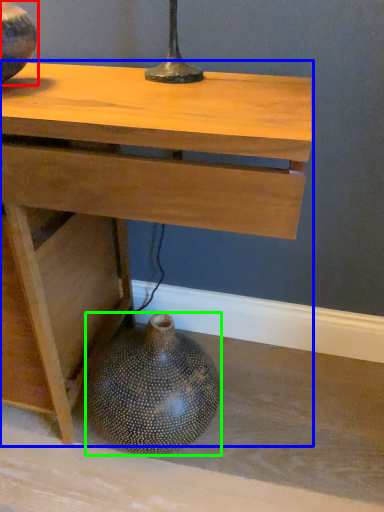
Question: Estimate the real-world distances between objects in this image. Which object is farther from vase (highlighted by a red box), table (highlighted by a blue box) or vase (highlighted by a green box)?

Choices:
 (A) table
 (B) vase

Answer: (B)